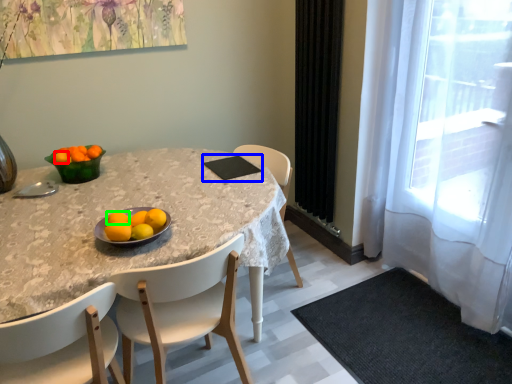
Question: Which is nearer to the tangerine (highlighted by a red box)? pad (highlighted by a blue box) or orange (highlighted by a green box).

Choices:
 (A) pad
 (B) orange

Answer: (B)